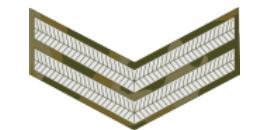
Where is `artwork`? Image resolution: width=266 pixels, height=130 pixels. artwork is located at coordinates (196, 62).